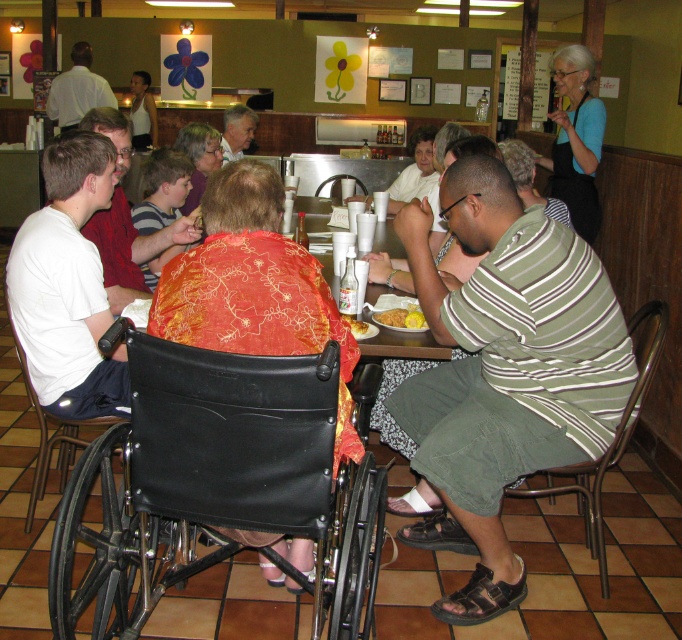
Does striped cotton shirt at center appear over yellow matte cornbread at center?

No, striped cotton shirt at center is not above yellow matte cornbread at center.

Is striped cotton shirt at center thinner than yellow matte cornbread at center?

Incorrect, striped cotton shirt at center's width is not less than yellow matte cornbread at center's.

At what (x,y) coordinates should I click in order to perform the action: click on striped cotton shirt at center. Please return your answer as a coordinate pair (x, y). This screenshot has width=682, height=640. Looking at the image, I should click on (505, 371).

Is black leather wheelchair at center taller than wooden table at center?

Yes.

Find the location of `black leather wheelchair at center`. black leather wheelchair at center is located at coordinates (216, 483).

Does point (325, 528) lie behind point (421, 333)?

That is False.

The height and width of the screenshot is (640, 682). I want to click on black leather wheelchair at center, so click(216, 483).

Is black leather wheelchair at center taller than white shirt at upper left?

Indeed, black leather wheelchair at center has a greater height compared to white shirt at upper left.

Can you confirm if black leather wheelchair at center is wider than white shirt at upper left?

No, black leather wheelchair at center is not wider than white shirt at upper left.

Does point (123, 611) lie behind point (72, 67)?

No, (123, 611) is in front of (72, 67).

Where is `black leather wheelchair at center`? black leather wheelchair at center is located at coordinates (216, 483).